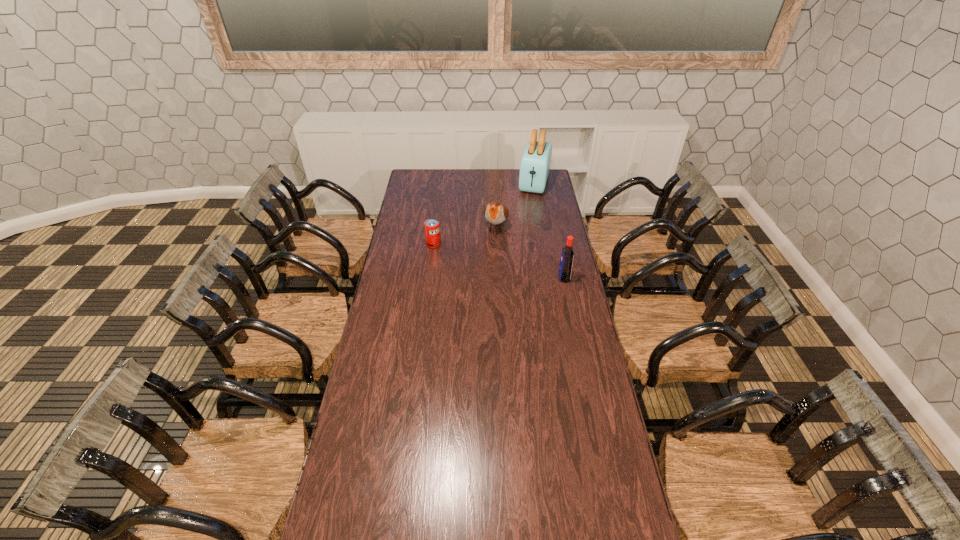
Identify the location of vacant spot on the desktop that is between the leftmost object and the third shortest object and is positioned at the face of the second shortest object. Image resolution: width=960 pixels, height=540 pixels. (485, 258).

Where is `free space on the desktop that is between the leftmost object and the vodka and is positioned on the side of the toaster with the lever`? The height and width of the screenshot is (540, 960). free space on the desktop that is between the leftmost object and the vodka and is positioned on the side of the toaster with the lever is located at coordinates (511, 264).